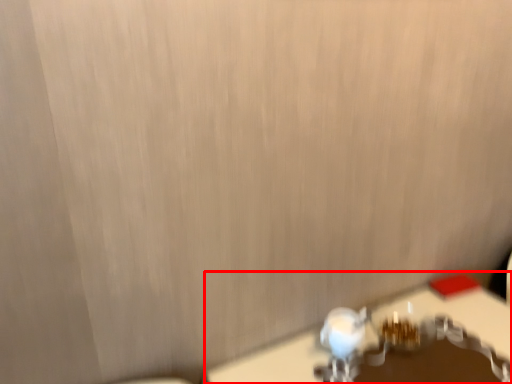
Question: From the image's perspective, what is the correct spatial relationship of table (annotated by the red box) in relation to faucet?

Choices:
 (A) above
 (B) below

Answer: (B)